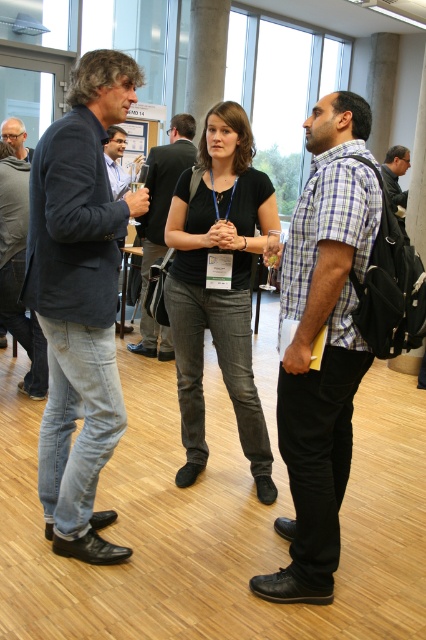
Locate an element on the screen. This screenshot has width=426, height=640. denim jeans at left is located at coordinates (80, 300).

Can you confirm if denim jeans at left is wider than black denim jeans at center?

No, denim jeans at left is not wider than black denim jeans at center.

This screenshot has height=640, width=426. In order to click on denim jeans at left in this screenshot , I will do `click(80, 300)`.

Can you confirm if black denim jeans at center is shorter than matte black glasses at upper left?

In fact, black denim jeans at center may be taller than matte black glasses at upper left.

Measure the distance between point [259,488] and camera.

Point [259,488] is 8.58 feet from camera.

I want to click on black denim jeans at center, so click(x=218, y=285).

Who is taller, denim jeans at left or plaid cotton shirt at center?

denim jeans at left is taller.

The image size is (426, 640). Find the location of `denim jeans at left`. denim jeans at left is located at coordinates (80, 300).